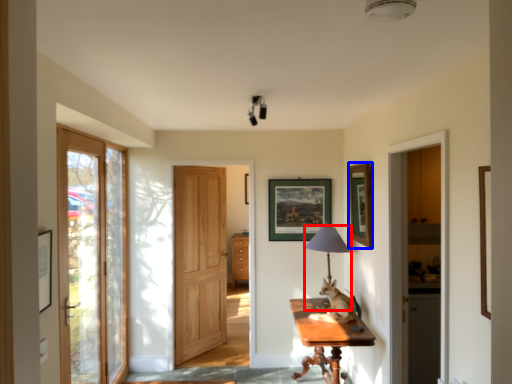
Question: Which of the following is the closest to the observer, table lamp (highlighted by a red box) or picture frame (highlighted by a blue box)?

Choices:
 (A) table lamp
 (B) picture frame

Answer: (B)